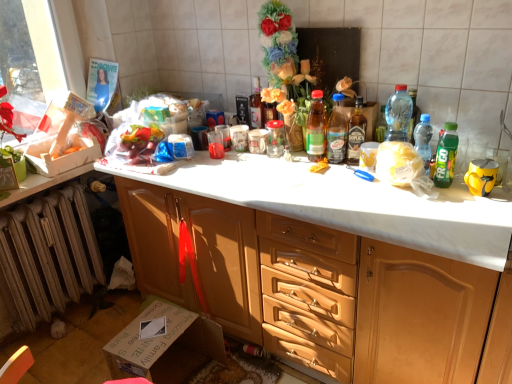
Locate an element on the screen. Image resolution: width=512 pixels, height=384 pixels. free space in front of green plastic bottle at right, which ranks as the 7th bottle in left-to-right order is located at coordinates (463, 206).